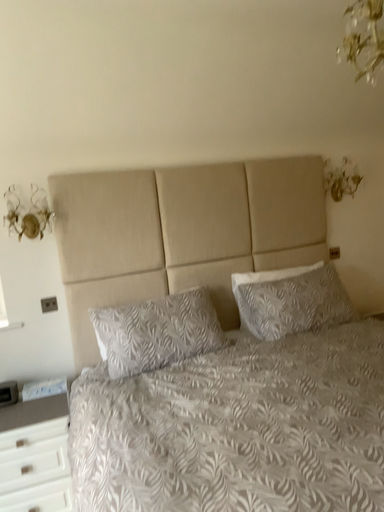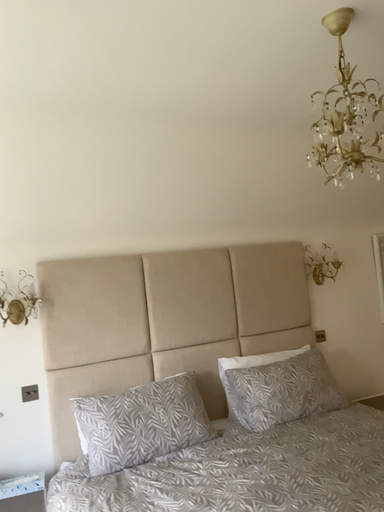
Question: How did the camera likely rotate when shooting the video?

Choices:
 (A) rotated downward
 (B) rotated upward

Answer: (B)